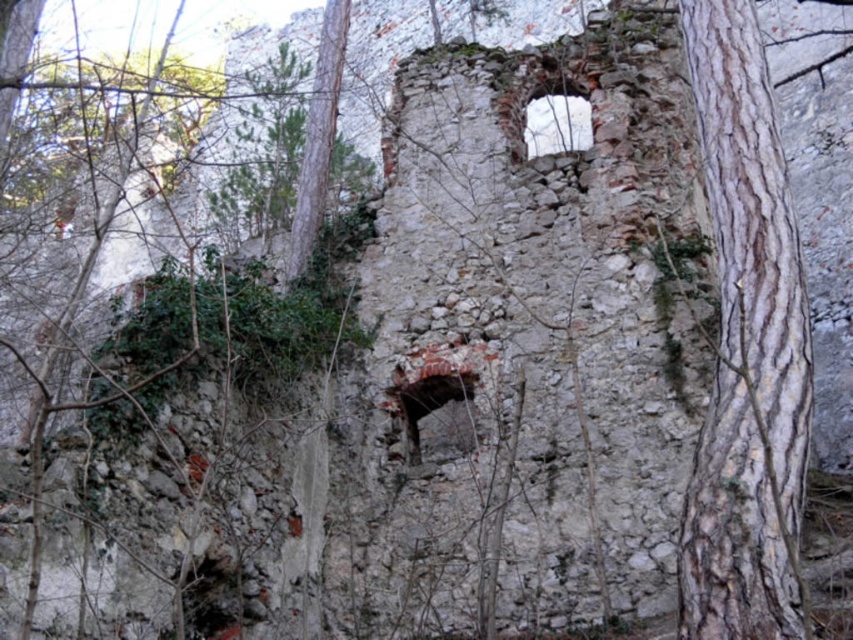
What can be found at the coordinates point (317,138) in the image?

At point (317,138) lies smooth brown bark at center.

You are standing in front of the stone structure and want to know the distance to a specific point marked as point (747, 342). Can you estimate how far it is from your current position?

The point (747, 342) is 41.89 meters away from the viewer.